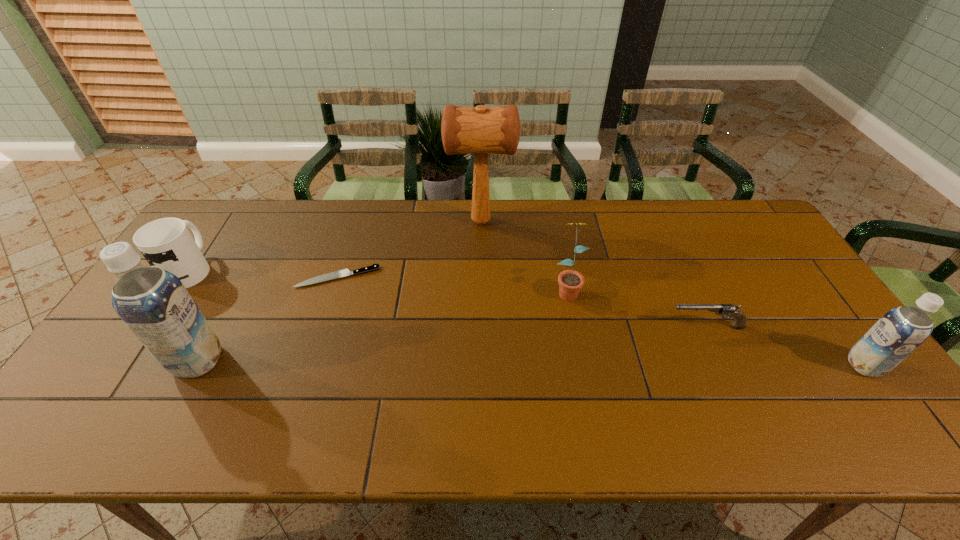
This screenshot has height=540, width=960. Identify the location of vacant space situated on the right of the third object from left to right. (488, 277).

What are the coordinates of `vacant region located aiming along the barrel of the fifth farthest object` in the screenshot? It's located at (608, 327).

Locate an element on the screen. This screenshot has height=540, width=960. free location located 0.310m aiming along the barrel of the fifth farthest object is located at coordinates (553, 327).

The width and height of the screenshot is (960, 540). Identify the location of vacant space located 0.130m aiming along the barrel of the fifth farthest object. (619, 327).

This screenshot has width=960, height=540. I want to click on free space located 0.160m on the handle side of the third shortest object, so click(x=223, y=219).

What are the coordinates of `blank space located on the handle side of the third shortest object` in the screenshot? It's located at (228, 211).

Find the location of `free region located on the handle side of the third shortest object`. free region located on the handle side of the third shortest object is located at coordinates point(228,212).

Where is `free point located on the flower of the sunflower`? The width and height of the screenshot is (960, 540). free point located on the flower of the sunflower is located at coordinates (581, 360).

At what (x,y) coordinates should I click in order to perform the action: click on object at the far edge. Please return your answer as a coordinate pair (x, y). Looking at the image, I should click on (481, 130).

The image size is (960, 540). I want to click on object at the left edge, so click(x=166, y=243).